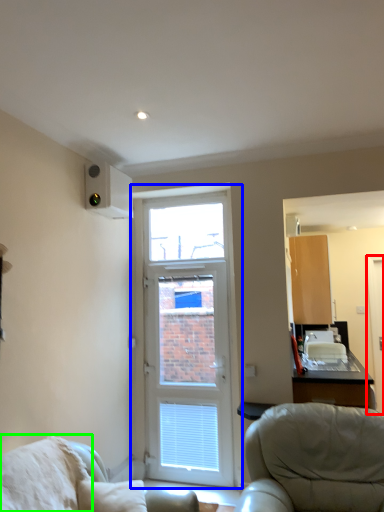
Question: Considering the real-world distances, which object is closest to screen door (highlighted by a red box)? door (highlighted by a blue box) or pillow (highlighted by a green box).

Choices:
 (A) door
 (B) pillow

Answer: (A)